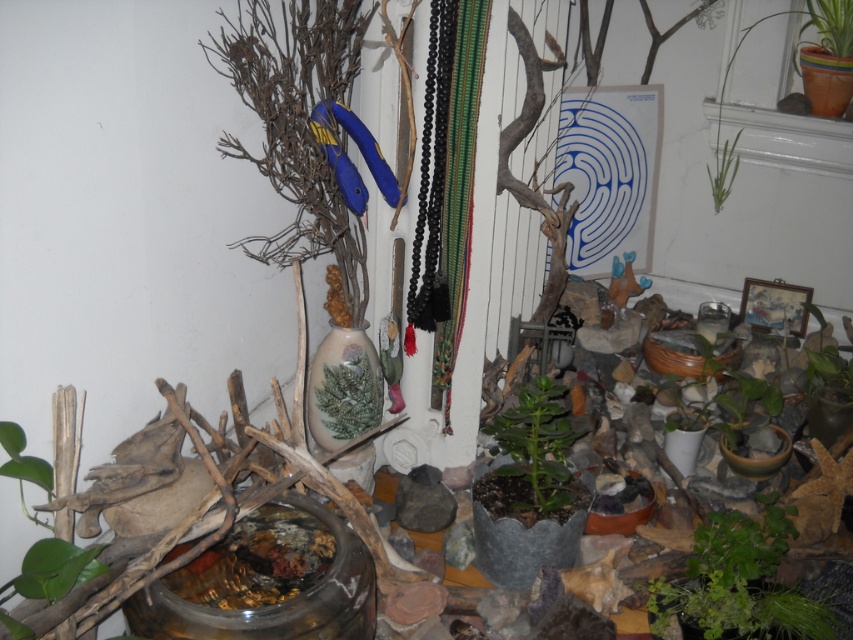
Looking at this image, you are arranging a small garden in your living room and have two plants to place. You want to know which plant is taller to decide where to put it. Which plant is taller between the green matte plant at center and the green leafy plant at upper right?

The green matte plant at center is taller than the green leafy plant at upper right.

You are standing in front of the shrine and want to water both the green matte plant at center and the green leafy plant at upper right. If your watering can has a maximum reach of 3 feet, can you water both plants without moving closer?

The green matte plant at center is 3.36 feet away from the green leafy plant at upper right. Since the distance between them is greater than the watering can reach of 3 feet, you cannot water both plants without moving closer.